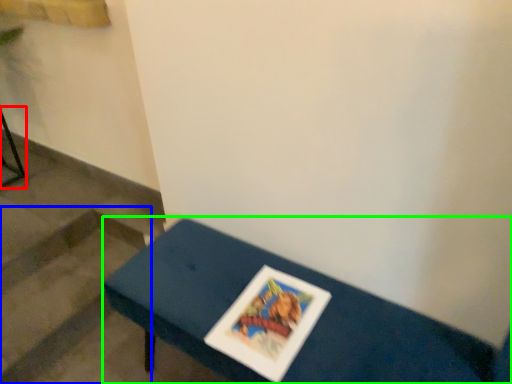
Question: Which is nearer to the furniture (highlighted by a red box)? stairwell (highlighted by a blue box) or table (highlighted by a green box).

Choices:
 (A) stairwell
 (B) table

Answer: (A)